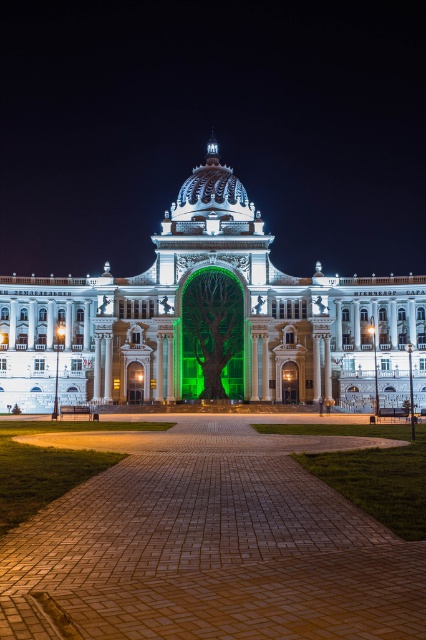
You are standing on the brick paved plaza at center and want to walk towards the green matte tree at center. Which direction should you move?

You should move to the right because the brick paved plaza at center is to the left of the green matte tree at center, so moving right would take you towards it.

You are standing in front of the grand, illuminated building at night. If you want to take a photo of the white marble palace at center, where should you aim your camera? Please provide coordinates based on a grid system where the bottom left corner is 0,0 and the top right corner is 1,1.

The white marble palace at center is located at coordinates approximately [210,321] on the grid system, so aim your camera there.